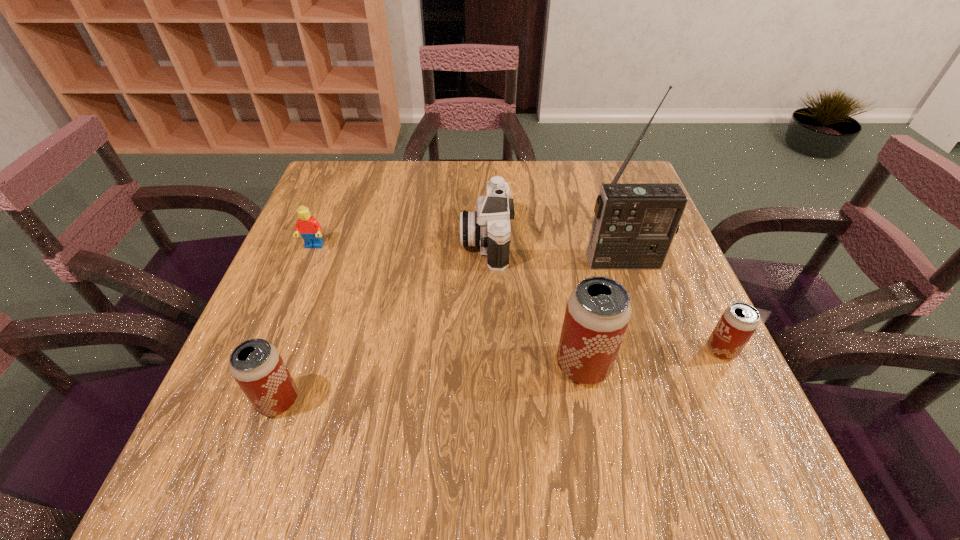
Where is `vacant space situated on the back of the fourth object from left to right`? vacant space situated on the back of the fourth object from left to right is located at coordinates (556, 227).

I want to click on vacant space located on the left of the shortest beer can, so [x=591, y=350].

The image size is (960, 540). In order to click on vacant space situated on the face of the Lego in this screenshot , I will do pyautogui.click(x=306, y=266).

Locate an element on the screen. This screenshot has height=540, width=960. vacant space located 0.320m on the left of the fourth object from right to left is located at coordinates (330, 239).

You are a GUI agent. You are given a task and a screenshot of the screen. Output one action in this format:
    pyautogui.click(x=<x>, y=<y>)
    Task: Click on the vacant space positioned on the display of the tallest object
    Image resolution: width=960 pixels, height=540 pixels.
    Given the screenshot: What is the action you would take?
    pyautogui.click(x=676, y=414)

At what (x,y) coordinates should I click in order to perform the action: click on beer can that is at the left edge. Please return your answer as a coordinate pair (x, y). This screenshot has height=540, width=960. Looking at the image, I should click on (256, 365).

The height and width of the screenshot is (540, 960). I want to click on Lego that is at the left edge, so click(x=310, y=229).

Identify the location of beer can at the right edge. (739, 321).

The width and height of the screenshot is (960, 540). What are the coordinates of `radio receiver located at the right edge` in the screenshot? It's located at (634, 225).

Locate an element on the screen. object present at the near left corner is located at coordinates (256, 365).